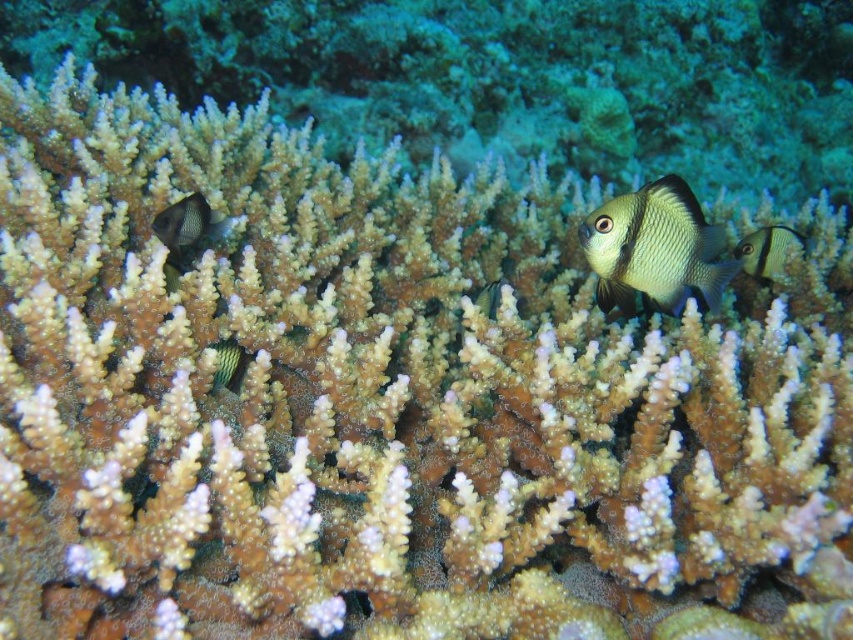
Does black matte fish at left appear over green striped fish at center?

Indeed, black matte fish at left is positioned over green striped fish at center.

Does black matte fish at left appear on the right side of green striped fish at center?

No, black matte fish at left is not to the right of green striped fish at center.

Is point (199, 237) behind point (224, 376)?

Yes.

I want to click on black matte fish at left, so click(x=189, y=225).

Can you confirm if shiny green fish at center is thinner than shiny silver fish at center?

Incorrect, shiny green fish at center's width is not less than shiny silver fish at center's.

Is shiny green fish at center below shiny silver fish at center?

Indeed, shiny green fish at center is positioned under shiny silver fish at center.

Find the location of a particular element. The height and width of the screenshot is (640, 853). shiny green fish at center is located at coordinates (654, 250).

Where is `shiny green fish at center`? shiny green fish at center is located at coordinates click(654, 250).

Measure the distance between point (186, 220) and camera.

5.55 feet

Can you confirm if black matte fish at left is taller than shiny silver fish at center?

Incorrect, black matte fish at left's height is not larger of shiny silver fish at center's.

Who is more forward, (169, 225) or (781, 227)?

Point (169, 225)

Image resolution: width=853 pixels, height=640 pixels. Find the location of `black matte fish at left`. black matte fish at left is located at coordinates (189, 225).